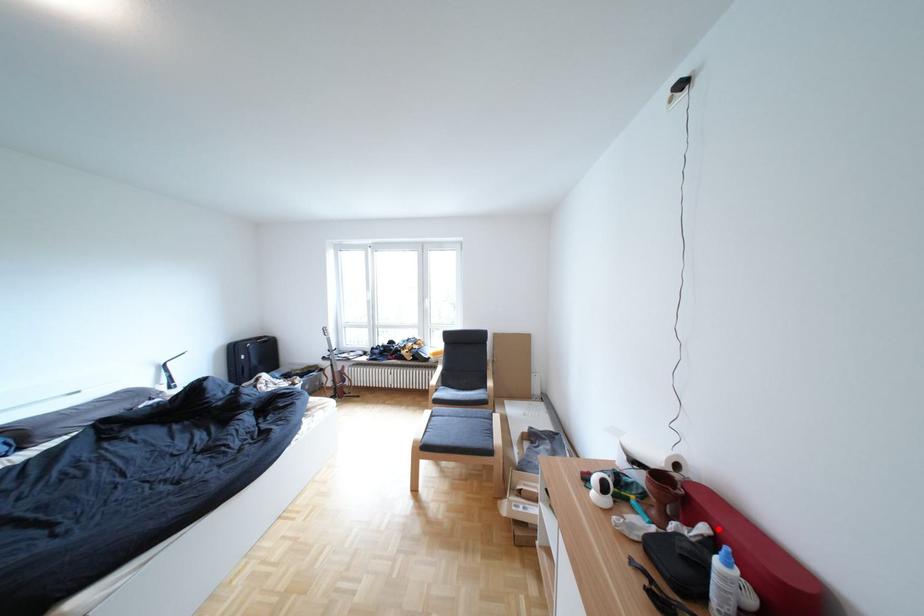
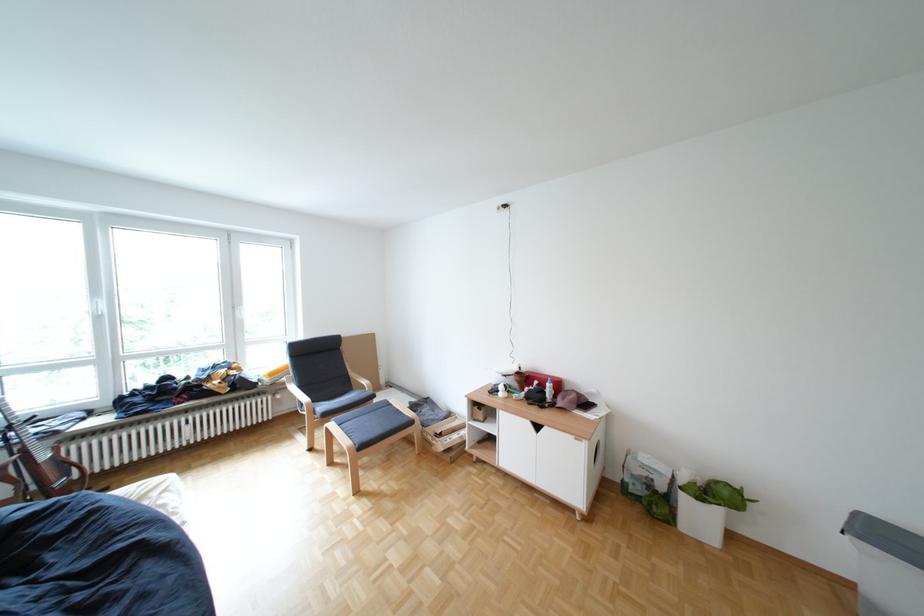
In the second image, find the point that corresponds to the highlighted location in the first image.

(552, 383)